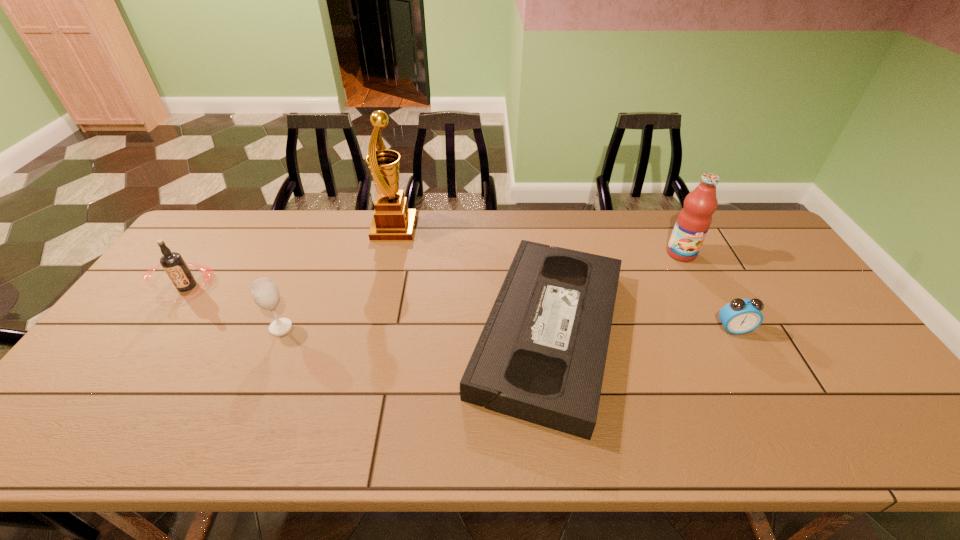
Where is `object that is the closest to the third object from left to right`? object that is the closest to the third object from left to right is located at coordinates (541, 355).

Point out which object is positioned as the third nearest to the alarm clock. Please provide its 2D coordinates. Your answer should be formatted as a tuple, i.e. [(x, y)], where the tuple contains the x and y coordinates of a point satisfying the conditions above.

[(392, 221)]

Where is `vacant area in the image that satisfies the following two spatial constraints: 1. on the front-facing side of the shortest object; 2. on the left side of the tallest object`? vacant area in the image that satisfies the following two spatial constraints: 1. on the front-facing side of the shortest object; 2. on the left side of the tallest object is located at coordinates (370, 332).

The image size is (960, 540). In order to click on blank space that satisfies the following two spatial constraints: 1. on the label of the videotape; 2. on the right side of the root beer in this screenshot , I will do `click(156, 332)`.

Locate an element on the screen. free spot that satisfies the following two spatial constraints: 1. on the label of the shortest object; 2. on the left side of the leftmost object is located at coordinates (156, 332).

The image size is (960, 540). In order to click on vacant space that satisfies the following two spatial constraints: 1. on the front-facing side of the third object from left to right; 2. on the label of the leftmost object in this screenshot , I will do `click(381, 287)`.

The height and width of the screenshot is (540, 960). What are the coordinates of `free space that satisfies the following two spatial constraints: 1. on the front-facing side of the award; 2. on the front side of the second object from left to right` in the screenshot? It's located at (371, 328).